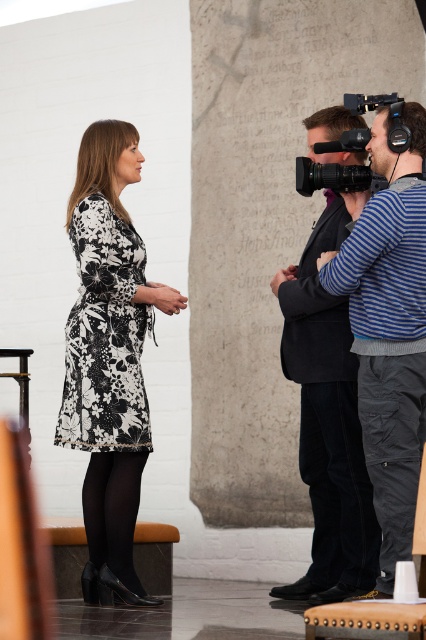
You are a photographer at the event and need to position a light source between the black floral dress at left and the dark gray cotton pants at lower right. Which side should the light be placed closer to ensure it illuminates the wider object adequately?

The black floral dress at left is wider than the dark gray cotton pants at lower right. Therefore, the light should be placed closer to the black floral dress at left to ensure proper illumination of the wider object.

You are standing in the room and want to place a small decorative item on the closest point between the two points labeled point (419, 262) and point (354, 572). Which point should you choose?

Point (419, 262) is closer to the viewer than point (354, 572), so you should place the decorative item on point (419, 262).